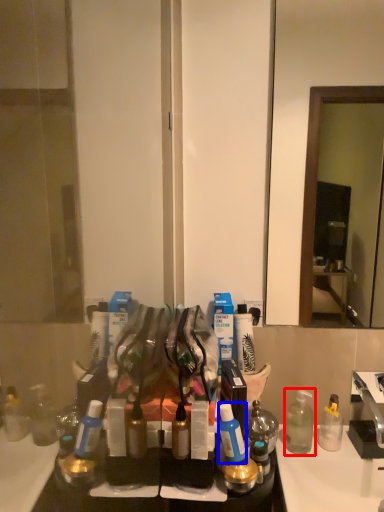
Question: Which of the following is the closest to the observer, bottle (highlighted by a red box) or toiletry (highlighted by a blue box)?

Choices:
 (A) bottle
 (B) toiletry

Answer: (B)